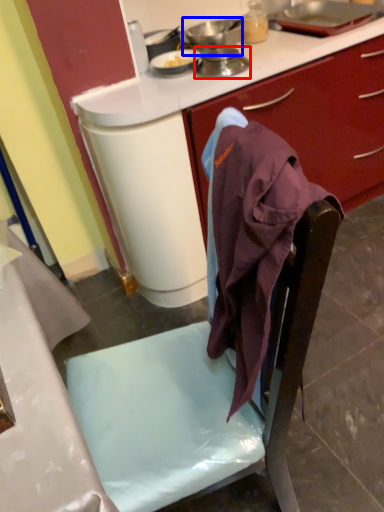
Question: Which object appears farthest to the camera in this image, kitchen appliance (highlighted by a red box) or kitchen appliance (highlighted by a blue box)?

Choices:
 (A) kitchen appliance
 (B) kitchen appliance

Answer: (B)